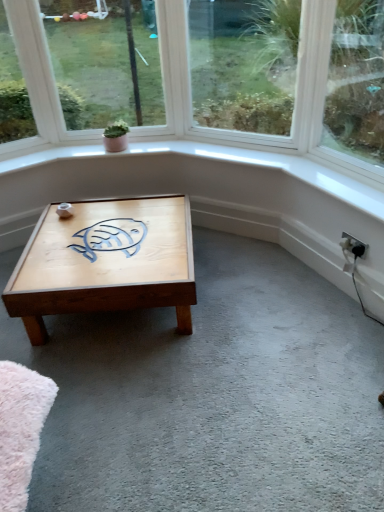
Question: From a real-world perspective, does light brown wooden coffee table at center stand above white plastic electric outlet at lower right?

Choices:
 (A) no
 (B) yes

Answer: (A)

Question: Is light brown wooden coffee table at center at the left side of white plastic electric outlet at lower right?

Choices:
 (A) no
 (B) yes

Answer: (B)

Question: Is light brown wooden coffee table at center bigger than white plastic electric outlet at lower right?

Choices:
 (A) yes
 (B) no

Answer: (A)

Question: Is light brown wooden coffee table at center smaller than white plastic electric outlet at lower right?

Choices:
 (A) yes
 (B) no

Answer: (B)

Question: From the image's perspective, is light brown wooden coffee table at center beneath white plastic electric outlet at lower right?

Choices:
 (A) yes
 (B) no

Answer: (A)

Question: Choose the correct answer: Is white plastic electric outlet at lower right inside light brown wooden coffee table at center or outside it?

Choices:
 (A) outside
 (B) inside

Answer: (A)

Question: In the image, is white plastic electric outlet at lower right on the left side or the right side of light brown wooden coffee table at center?

Choices:
 (A) left
 (B) right

Answer: (B)

Question: Is white plastic electric outlet at lower right taller or shorter than light brown wooden coffee table at center?

Choices:
 (A) short
 (B) tall

Answer: (A)

Question: Is point (367, 245) positioned closer to the camera than point (31, 267)?

Choices:
 (A) closer
 (B) farther

Answer: (B)

Question: Considering the positions of point (119, 131) and point (218, 60), is point (119, 131) closer or farther from the camera than point (218, 60)?

Choices:
 (A) closer
 (B) farther

Answer: (A)

Question: Is green matte plant at upper center inside or outside of clear glass window at center, positioned as the second window in left-to-right order?

Choices:
 (A) outside
 (B) inside

Answer: (A)

Question: In terms of height, does green matte plant at upper center look taller or shorter compared to clear glass window at center, positioned as the second window in left-to-right order?

Choices:
 (A) short
 (B) tall

Answer: (A)

Question: Is green matte plant at upper center to the left or to the right of clear glass window at center, positioned as the second window in left-to-right order, in the image?

Choices:
 (A) right
 (B) left

Answer: (B)

Question: From a real-world perspective, is light brown wooden coffee table at center above or below clear glass window at center, the first window from the right?

Choices:
 (A) below
 (B) above

Answer: (A)

Question: From the image's perspective, is light brown wooden coffee table at center above or below clear glass window at center, positioned as the second window in left-to-right order?

Choices:
 (A) above
 (B) below

Answer: (B)